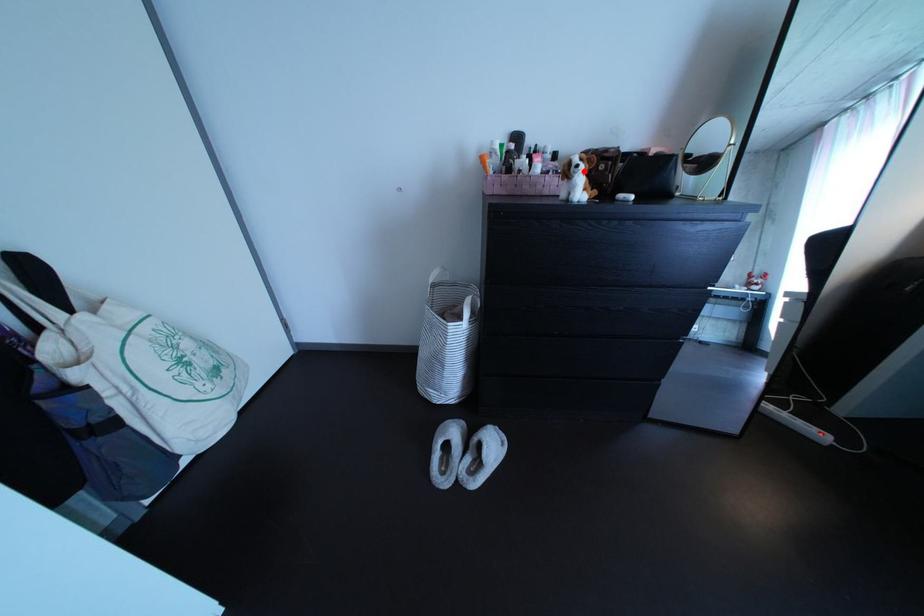
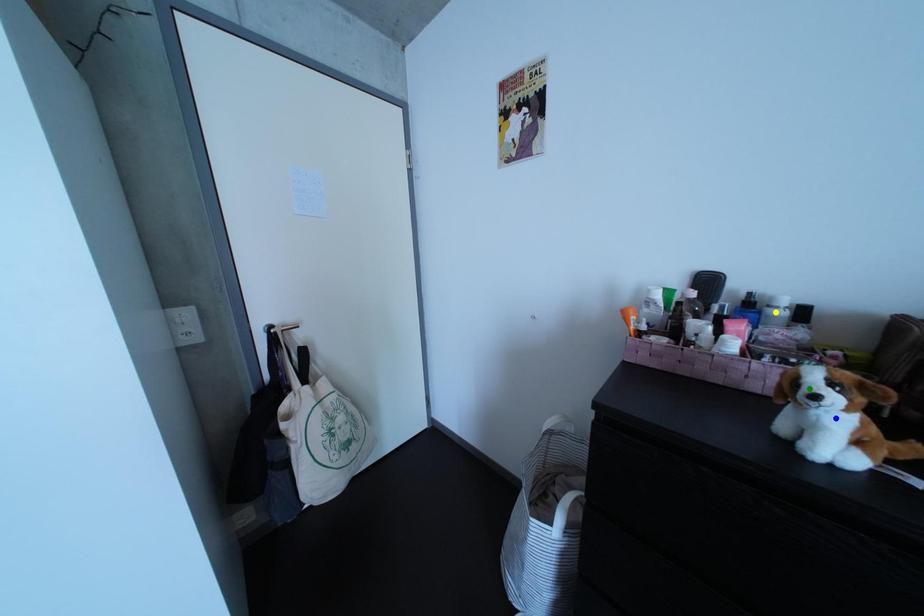
Question: I am providing you with two images of the same scene from different viewpoints. A red point is marked on the first image. You are given multiple points on the second image. Which mark in image 2 goes with the point in image 1?

Choices:
 (A) yellow point
 (B) green point
 (C) blue point

Answer: (B)